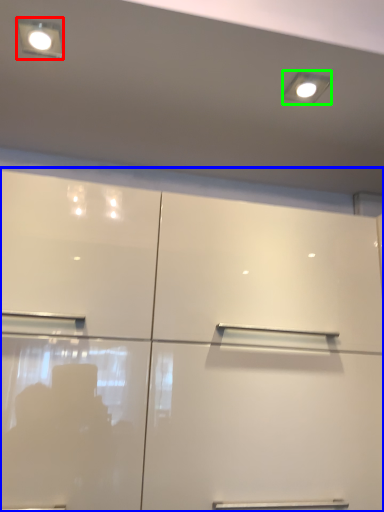
Question: Based on their relative distances, which object is nearer to light fixture (highlighted by a red box)? Choose from cupboard (highlighted by a blue box) and lighting (highlighted by a green box).

Choices:
 (A) cupboard
 (B) lighting

Answer: (B)